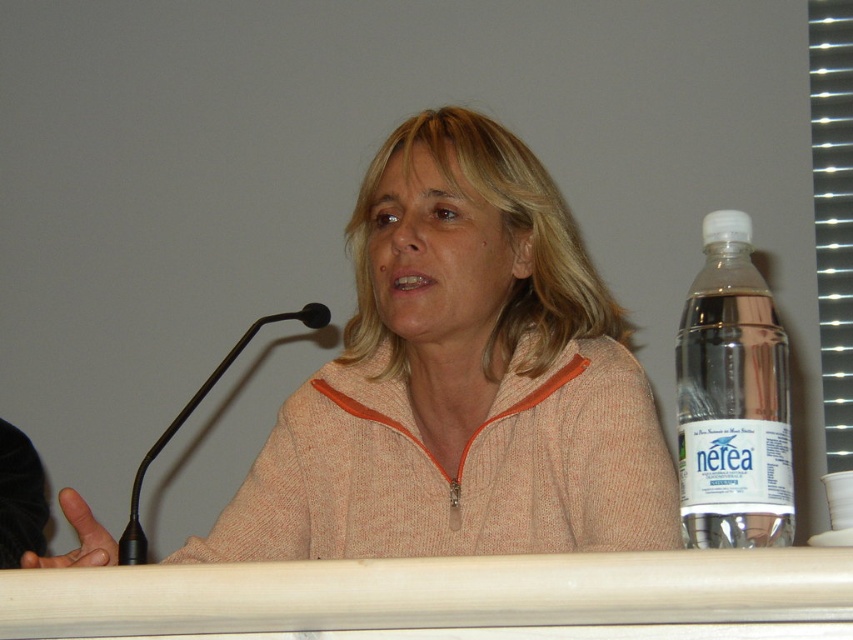
Does orange knit sweater at center have a lesser width compared to black plastic microphone at left?

In fact, orange knit sweater at center might be wider than black plastic microphone at left.

Is orange knit sweater at center further to camera compared to black plastic microphone at left?

Yes, orange knit sweater at center is behind black plastic microphone at left.

This screenshot has width=853, height=640. What do you see at coordinates (461, 380) in the screenshot? I see `orange knit sweater at center` at bounding box center [461, 380].

Where is `orange knit sweater at center`? Image resolution: width=853 pixels, height=640 pixels. orange knit sweater at center is located at coordinates (461, 380).

Is orange knit sweater at center wider than clear plastic bottle at right?

Correct, the width of orange knit sweater at center exceeds that of clear plastic bottle at right.

Looking at this image, is orange knit sweater at center to the left of clear plastic bottle at right from the viewer's perspective?

Correct, you'll find orange knit sweater at center to the left of clear plastic bottle at right.

Is point (309, 477) closer to camera compared to point (780, 392)?

No.

Locate an element on the screen. The width and height of the screenshot is (853, 640). orange knit sweater at center is located at coordinates (461, 380).

Can you confirm if white wood table at center is taller than clear plastic bottle at right?

In fact, white wood table at center may be shorter than clear plastic bottle at right.

Which of these two, white wood table at center or clear plastic bottle at right, stands taller?

clear plastic bottle at right

Is point (274, 568) in front of point (740, 472)?

That is True.

I want to click on white wood table at center, so click(x=431, y=593).